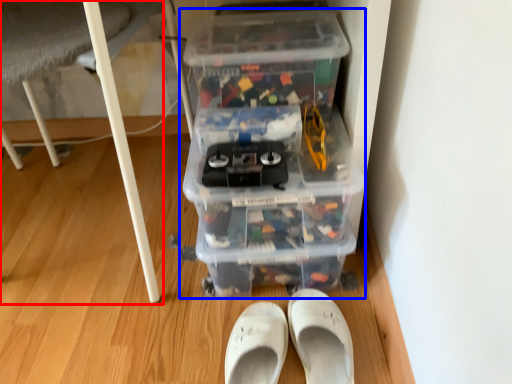
Question: Among these objects, which one is farthest to the camera, furniture (highlighted by a red box) or storage box (highlighted by a blue box)?

Choices:
 (A) furniture
 (B) storage box

Answer: (B)